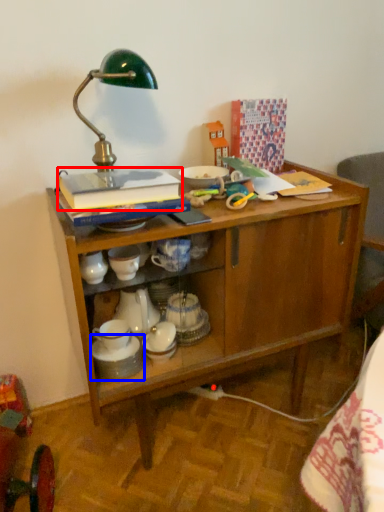
Question: Which point is closer to the camera, book (highlighted by a red box) or tableware (highlighted by a blue box)?

Choices:
 (A) book
 (B) tableware

Answer: (A)